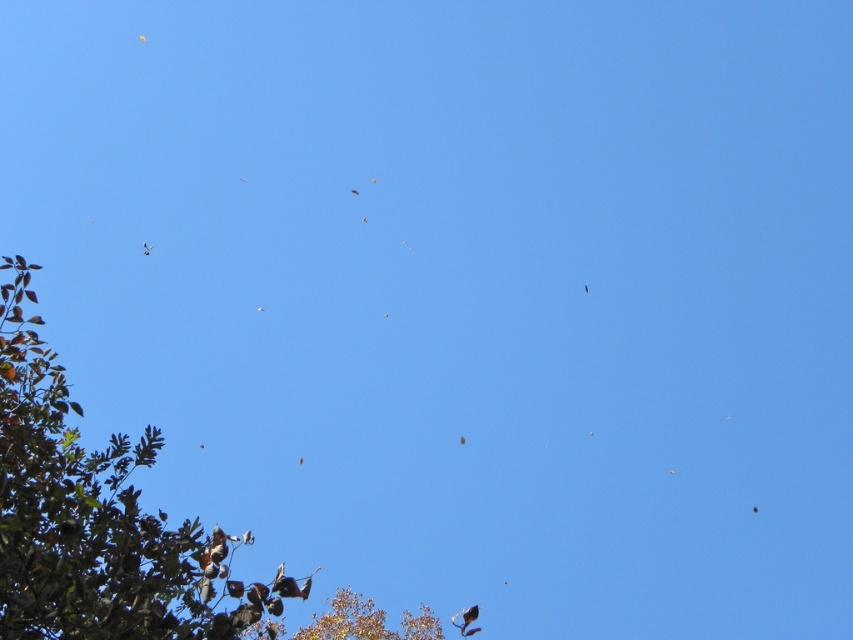
Is brown leafy tree at lower left bigger than brown feathered bird at center?

Indeed, brown leafy tree at lower left has a larger size compared to brown feathered bird at center.

What do you see at coordinates (366, 621) in the screenshot?
I see `brown leafy tree at lower left` at bounding box center [366, 621].

Is point (381, 612) less distant than point (352, 193)?

Yes, point (381, 612) is closer to viewer.

I want to click on brown leafy tree at lower left, so click(x=366, y=621).

Is brown leafy tree at lower left wider than smooth feathered bird at center?

Correct, the width of brown leafy tree at lower left exceeds that of smooth feathered bird at center.

Does point (337, 620) come closer to viewer compared to point (584, 288)?

Yes, point (337, 620) is closer to viewer.

Image resolution: width=853 pixels, height=640 pixels. Identify the location of brown leafy tree at lower left. (366, 621).

Consider the image. Is shiny black bird at bottom right positioned at the back of brown feathered bird at center?

That is False.

Which of these two, shiny black bird at bottom right or brown feathered bird at center, stands taller?

With more height is shiny black bird at bottom right.

The height and width of the screenshot is (640, 853). Describe the element at coordinates (466, 620) in the screenshot. I see `shiny black bird at bottom right` at that location.

Image resolution: width=853 pixels, height=640 pixels. Identify the location of shiny black bird at bottom right. (466, 620).